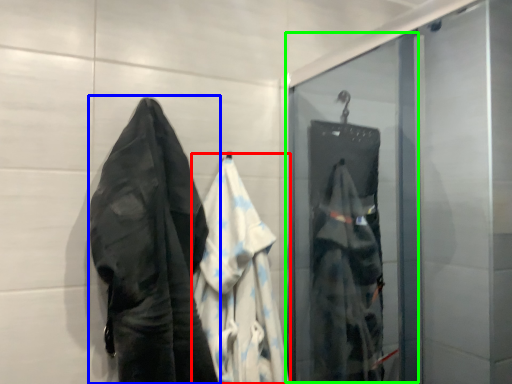
Question: Which is nearer to the garment (highlighted by a red box)? towel (highlighted by a blue box) or screen door (highlighted by a green box).

Choices:
 (A) towel
 (B) screen door

Answer: (A)